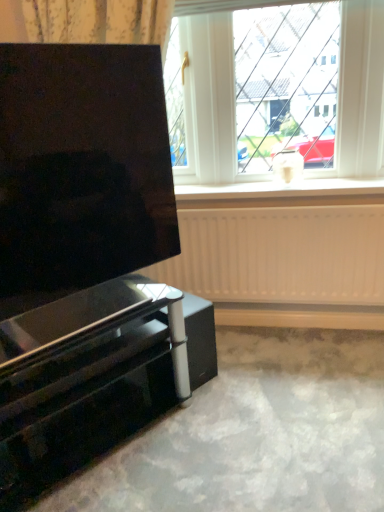
Find the location of a particular element. Image resolution: width=384 pixels, height=512 pixels. vacant space underneath white plastic window at upper center (from a real-world perspective) is located at coordinates (241, 190).